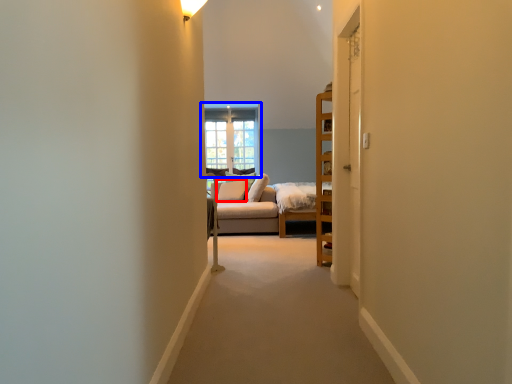
Question: Which object appears closest to the camera in this image, pillow (highlighted by a red box) or window (highlighted by a blue box)?

Choices:
 (A) pillow
 (B) window

Answer: (A)